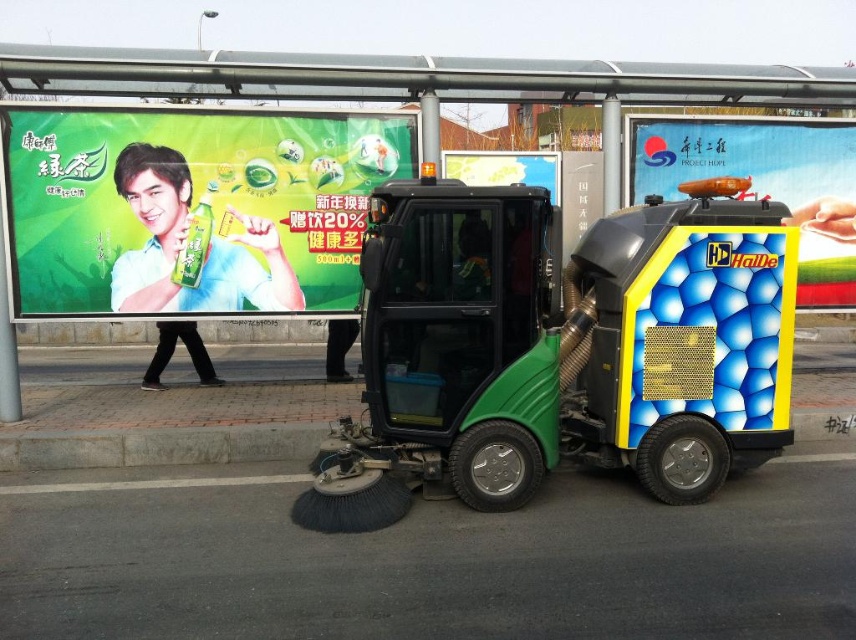
You are a delivery person with a box that is 1 meter long. You need to place it between the green matte bus stop at center and the green matte street sweeper at center. Is there enough space to fit the box?

The green matte bus stop at center and green matte street sweeper at center are 96.78 centimeters apart. Since the box is 1 meter long, which is 100 centimeters, the space between them is insufficient to fit the box.

You are a pedestrian standing on the sidewalk looking at the green matte street sweeper at center and the yellow metallic billboard at center. Which object is positioned higher from the ground?

The yellow metallic billboard at center is higher from the ground than the green matte street sweeper at center because the green matte street sweeper at center is located below it.